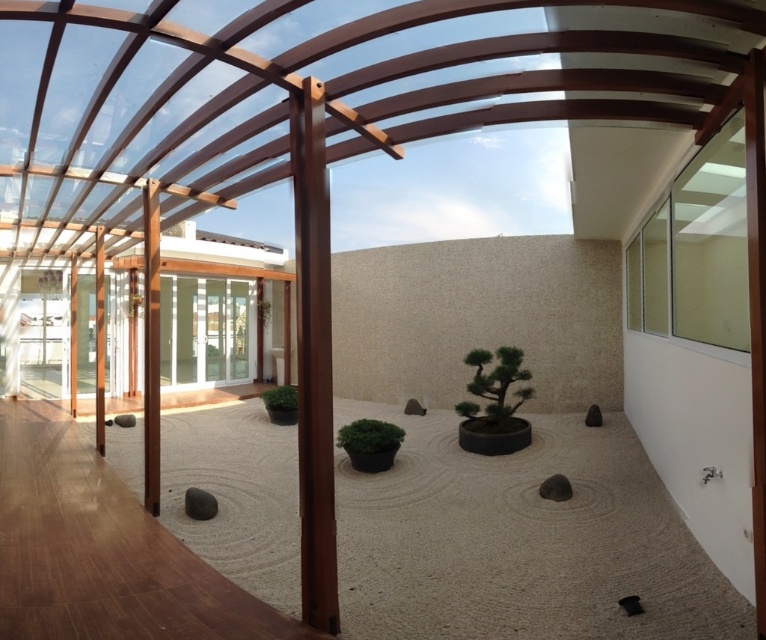
You are standing in the room and want to touch both the green matte bonsai at center and the green matte plant at center. Which one can you reach first without moving your feet?

The green matte bonsai at center is closer to you than the green matte plant at center, so you can reach it first without moving your feet.

You are a gardener who needs to water both the green matte bonsai at center and the green matte plant at center. The watering can you have can only reach 3 feet. Can you water both plants without moving the watering can?

The distance between the green matte bonsai at center and the green matte plant at center is 3.94 feet, which is greater than the watering can reach of 3 feet. Therefore, you cannot water both plants without moving the watering can.

You are designing a layout for a small indoor garden and have two plants available. You have a green matte bonsai at center and a green matte plant at center. Which one will occupy more space in terms of width?

The green matte bonsai at center has a larger width than the green matte plant at center, so it will occupy more space in terms of width.